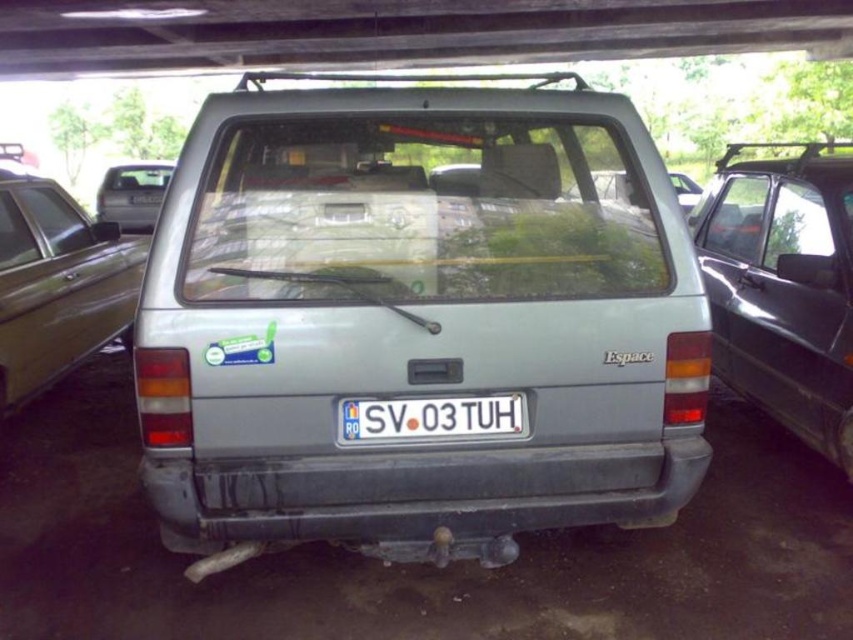
Question: Can you confirm if satin silver van at center is smaller than matte silver van at center?

Choices:
 (A) no
 (B) yes

Answer: (B)

Question: Based on their relative distances, which object is nearer to the satin silver van at center?

Choices:
 (A) gray matte bumper at center
 (B) matte gray van at left
 (C) matte silver van at center
 (D) white plastic license plate at center

Answer: (A)

Question: Can you confirm if satin silver van at center is thinner than gray matte bumper at center?

Choices:
 (A) no
 (B) yes

Answer: (A)

Question: Which point appears closest to the camera in this image?

Choices:
 (A) (534, 486)
 (B) (314, 476)

Answer: (B)

Question: Does metallic gray minivan at right have a smaller size compared to matte gray van at left?

Choices:
 (A) no
 (B) yes

Answer: (B)

Question: Which point is farther from the camera taking this photo?

Choices:
 (A) (343, 406)
 (B) (233, 369)
 (C) (45, 344)

Answer: (C)